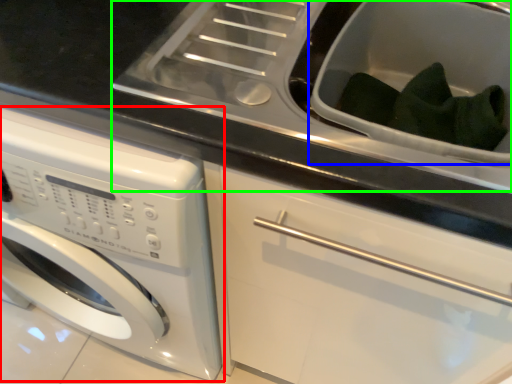
Question: Which object is the farthest from washing machine (highlighted by a red box)? Choose among these: sink (highlighted by a blue box) or sink (highlighted by a green box).

Choices:
 (A) sink
 (B) sink

Answer: (A)